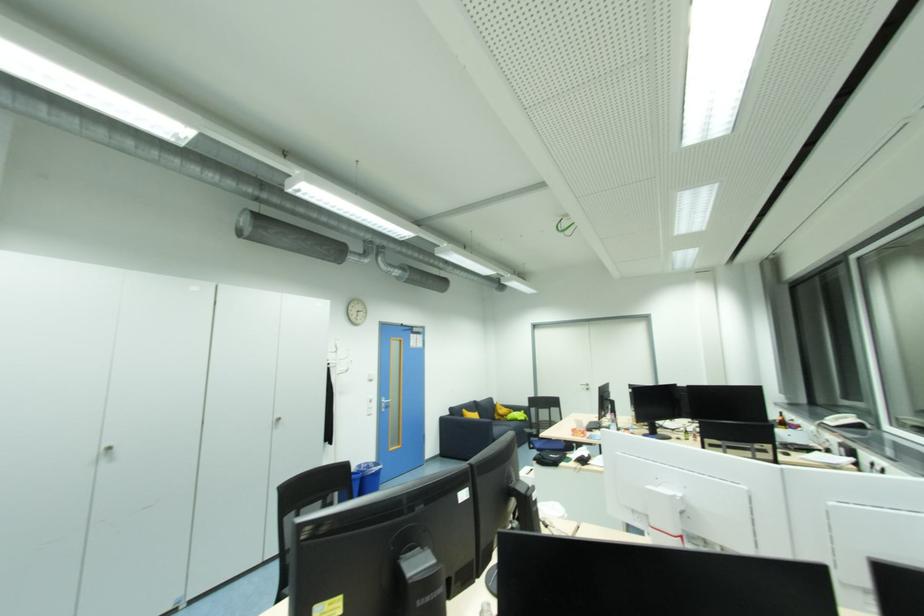
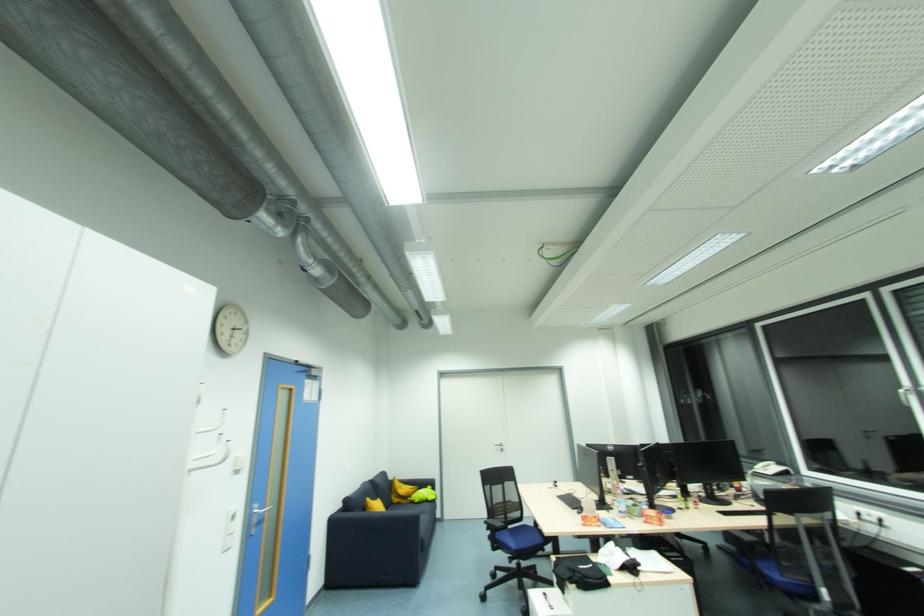
The point at [500,418] is marked in the first image. Where is the corresponding point in the second image?

(397, 501)